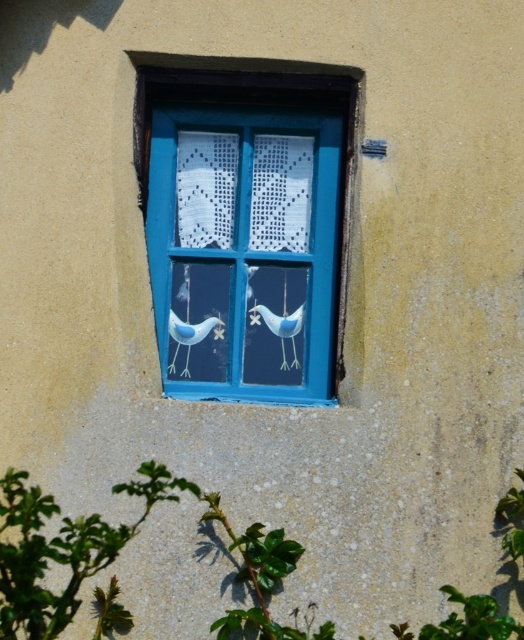
Is point (253, 312) behind point (190, 328)?

Yes, it is.

Which is in front, point (291, 339) or point (190, 332)?

Positioned in front is point (190, 332).

Identify the location of blue matte bird at center. The image size is (524, 640). (280, 326).

Does point (214, 202) come closer to viewer compared to point (188, 355)?

No.

Is point (343, 243) farther from camera compared to point (180, 330)?

No, it is not.

You are a GUI agent. You are given a task and a screenshot of the screen. Output one action in this format:
    pyautogui.click(x=<x>, y=<y>)
    Task: Click on the blue painted wood at center
    The image size is (524, 640).
    Given the screenshot: What is the action you would take?
    pyautogui.click(x=248, y=227)

Is point (232, 397) farther from camera compared to point (280, 337)?

No, it is in front of (280, 337).

Is point (206, 387) closer to viewer compared to point (282, 360)?

Yes, it is in front of point (282, 360).

Where is `blue painted wood at center`? blue painted wood at center is located at coordinates (248, 227).